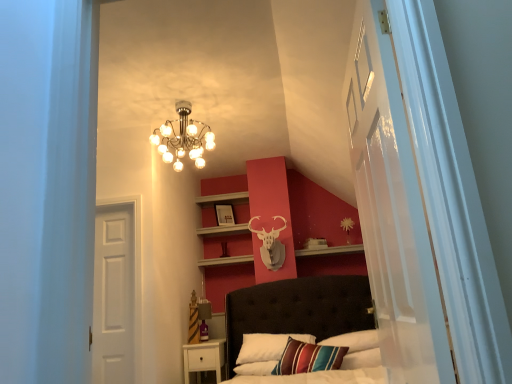
I want to click on matte wooden picture frame at upper center, so click(x=225, y=215).

At what (x,y) coordinates should I click in order to perform the action: click on white matte door at left. Please return your answer as a coordinate pair (x, y). Looking at the image, I should click on (113, 296).

Is transparent glass door at right wider or thinner than metallic chandelier at upper center?

In the image, transparent glass door at right appears to be more narrow than metallic chandelier at upper center.

Can you tell me how much transparent glass door at right and metallic chandelier at upper center differ in facing direction?

They differ by 87.3 degrees in their facing directions.

Is transparent glass door at right far from metallic chandelier at upper center?

transparent glass door at right is positioned a significant distance from metallic chandelier at upper center.

Considering the relative sizes of transparent glass door at right and metallic chandelier at upper center in the image provided, is transparent glass door at right bigger than metallic chandelier at upper center?

Correct, transparent glass door at right is larger in size than metallic chandelier at upper center.

Considering the positions of objects matte wooden picture frame at upper center and white matte door at left in the image provided, who is more to the left, matte wooden picture frame at upper center or white matte door at left?

Positioned to the left is white matte door at left.

Measure the distance from matte wooden picture frame at upper center to white matte door at left.

The distance of matte wooden picture frame at upper center from white matte door at left is 1.78 meters.

Can you tell me how much matte wooden picture frame at upper center and white matte door at left differ in facing direction?

The angular difference between matte wooden picture frame at upper center and white matte door at left is 28.4 degrees.

In terms of size, does matte wooden picture frame at upper center appear bigger or smaller than white matte door at left?

Considering their sizes, matte wooden picture frame at upper center takes up less space than white matte door at left.

Could matte wooden picture frame at upper center be considered to be inside transparent glass door at right?

No, matte wooden picture frame at upper center is located outside of transparent glass door at right.

Is transparent glass door at right in front of or behind matte wooden picture frame at upper center in the image?

Clearly, transparent glass door at right is in front of matte wooden picture frame at upper center.

Measure the distance from transparent glass door at right to matte wooden picture frame at upper center.

transparent glass door at right is 11.94 feet away from matte wooden picture frame at upper center.

Can you confirm if transparent glass door at right is positioned to the right of matte wooden picture frame at upper center?

Indeed, transparent glass door at right is positioned on the right side of matte wooden picture frame at upper center.

From the picture: Can we say transparent glass door at right lies outside white matte door at left?

Yes, transparent glass door at right is not within white matte door at left.

Is transparent glass door at right placed right next to white matte door at left?

There is a gap between transparent glass door at right and white matte door at left.

Looking at this image, between transparent glass door at right and white matte door at left, which one has smaller size?

Smaller between the two is white matte door at left.

Which is behind, transparent glass door at right or white matte door at left?

white matte door at left is further from the camera.

Is white matte door at left facing away from transparent glass door at right?

No, white matte door at left's orientation is not away from transparent glass door at right.

Who is more distant, white matte door at left or transparent glass door at right?

white matte door at left is more distant.

Does point (102, 213) appear closer or farther from the camera than point (417, 192)?

Clearly, point (102, 213) is more distant from the camera than point (417, 192).

From a real-world perspective, which is physically above, white matte door at left or transparent glass door at right?

In real-world perspective, transparent glass door at right is above.

Can you tell me how much matte wooden picture frame at upper center and metallic chandelier at upper center differ in facing direction?

The angle between the facing direction of matte wooden picture frame at upper center and the facing direction of metallic chandelier at upper center is 32.6 degrees.

Considering the positions of points (231, 210) and (191, 154), is point (231, 210) farther from camera compared to point (191, 154)?

Yes, point (231, 210) is farther from viewer.

This screenshot has height=384, width=512. In order to click on picture frame behind the metallic chandelier at upper center in this screenshot , I will do `click(225, 215)`.

Does matte wooden picture frame at upper center turn towards metallic chandelier at upper center?

No, matte wooden picture frame at upper center is not facing towards metallic chandelier at upper center.

Is point (101, 255) in front of point (160, 145)?

Yes, it is.

Which is more to the left, white matte door at left or metallic chandelier at upper center?

Positioned to the left is white matte door at left.

Identify the location of lamp above the white matte door at left (from a real-world perspective). This screenshot has height=384, width=512. (183, 138).

Which object is wider, white matte door at left or metallic chandelier at upper center?

metallic chandelier at upper center.

This screenshot has height=384, width=512. Find the location of `glass door that appears below the metallic chandelier at upper center (from the image's perspective)`. glass door that appears below the metallic chandelier at upper center (from the image's perspective) is located at coordinates (393, 209).

I want to click on picture frame that appears above the white matte door at left (from a real-world perspective), so click(x=225, y=215).

Considering their positions, is metallic chandelier at upper center positioned further to matte wooden picture frame at upper center than transparent glass door at right?

transparent glass door at right is further to matte wooden picture frame at upper center.

Looking at the image, which one is located further to white matte door at left, matte wooden picture frame at upper center or transparent glass door at right?

transparent glass door at right is further to white matte door at left.

Considering their positions, is transparent glass door at right positioned closer to matte wooden picture frame at upper center than metallic chandelier at upper center?

The object closer to matte wooden picture frame at upper center is metallic chandelier at upper center.

From the image, which object appears to be farther from transparent glass door at right, metallic chandelier at upper center or matte wooden picture frame at upper center?

matte wooden picture frame at upper center.

When comparing their distances from metallic chandelier at upper center, does white matte door at left or matte wooden picture frame at upper center seem closer?

Among the two, white matte door at left is located nearer to metallic chandelier at upper center.

When comparing their distances from transparent glass door at right, does matte wooden picture frame at upper center or white matte door at left seem further?

matte wooden picture frame at upper center is positioned further to the anchor transparent glass door at right.

Considering their positions, is metallic chandelier at upper center positioned closer to transparent glass door at right than white matte door at left?

Based on the image, metallic chandelier at upper center appears to be nearer to transparent glass door at right.

When comparing their distances from transparent glass door at right, does matte wooden picture frame at upper center or metallic chandelier at upper center seem further?

matte wooden picture frame at upper center is further to transparent glass door at right.

Locate an element on the screen. door between transparent glass door at right and matte wooden picture frame at upper center from front to back is located at coordinates (113, 296).

Locate an element on the screen. The image size is (512, 384). door located between metallic chandelier at upper center and matte wooden picture frame at upper center in the depth direction is located at coordinates (113, 296).

Where is `lamp between transparent glass door at right and matte wooden picture frame at upper center from front to back`? lamp between transparent glass door at right and matte wooden picture frame at upper center from front to back is located at coordinates (183, 138).

Find the location of `lamp between transparent glass door at right and white matte door at left in the front-back direction`. lamp between transparent glass door at right and white matte door at left in the front-back direction is located at coordinates (183, 138).